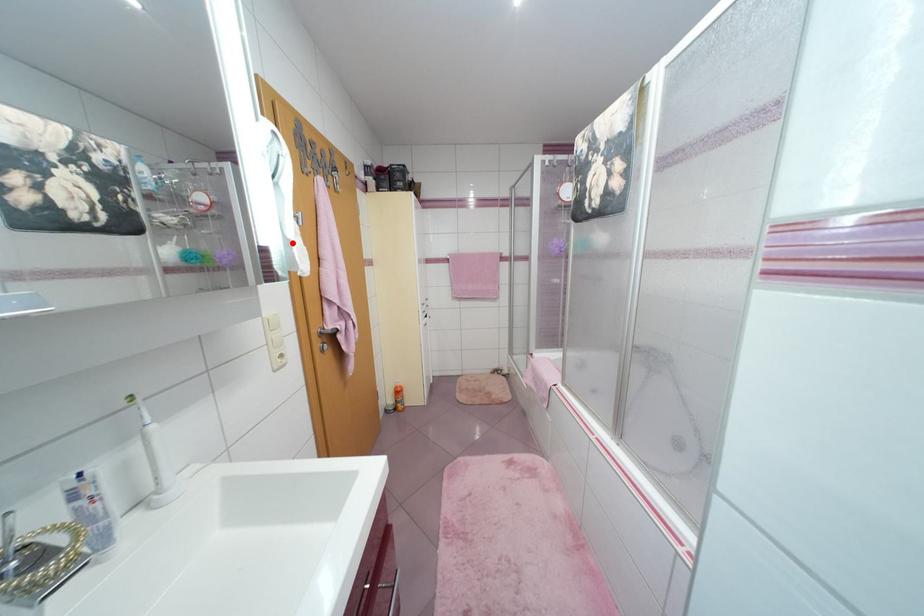
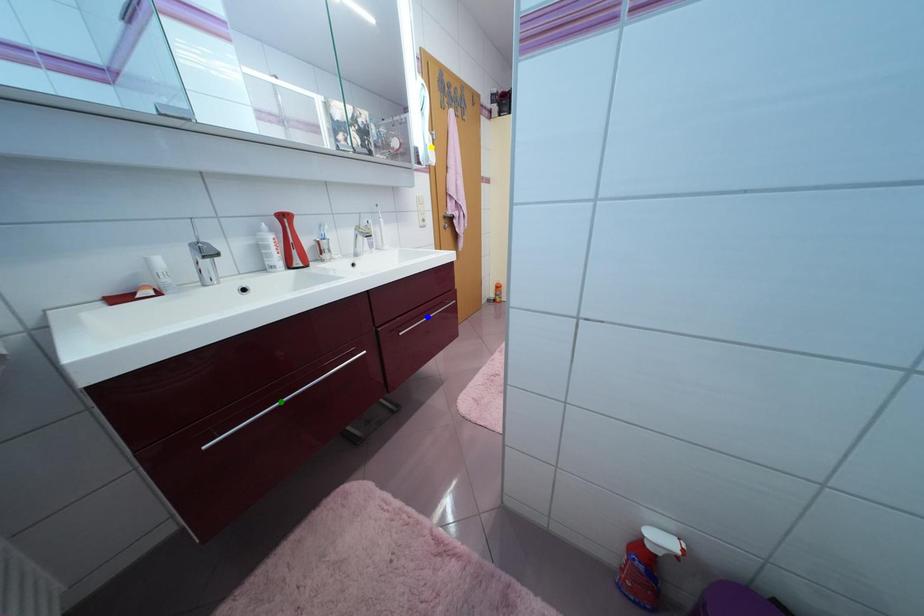
Question: I am providing you with two images of the same scene from different viewpoints. A red point is marked on the first image. You are given multiple points on the second image. Which point in image 2 represents the same 3d spot as the red point in image 1?

Choices:
 (A) blue point
 (B) yellow point
 (C) green point

Answer: (B)